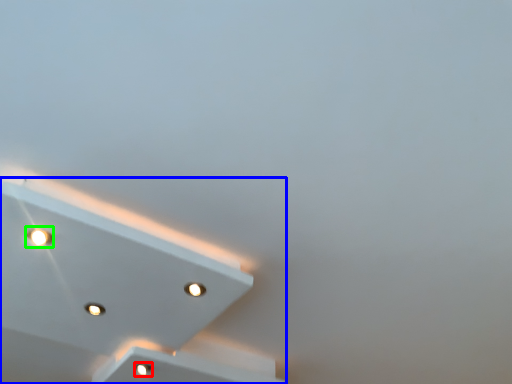
Question: Which object is positioned closest to dot (highlighted by a red box)? Select from lamp (highlighted by a blue box) and dot (highlighted by a green box).

Choices:
 (A) lamp
 (B) dot

Answer: (A)